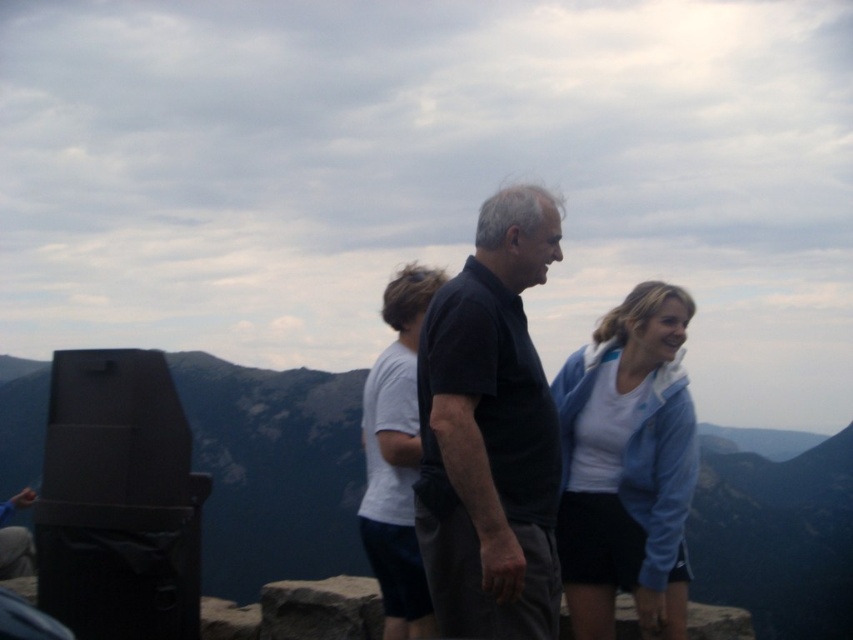
Question: From the image, what is the correct spatial relationship of black matte shirt at center in relation to light blue jacket at center?

Choices:
 (A) left
 (B) right

Answer: (A)

Question: Which object is the closest to the light blue jacket at center?

Choices:
 (A) black matte shirt at center
 (B) dark blue shirt at center
 (C) matte black grill at center-left

Answer: (B)

Question: Is dark blue shirt at center closer to the viewer compared to black matte shirt at center?

Choices:
 (A) no
 (B) yes

Answer: (B)

Question: Which point is closer to the camera?

Choices:
 (A) black matte shirt at center
 (B) matte black grill at center-left

Answer: (A)

Question: Among these points, which one is farthest from the camera?

Choices:
 (A) (595, 371)
 (B) (38, 368)
 (C) (529, 387)

Answer: (B)

Question: Can you confirm if black matte shirt at center is wider than light blue jacket at center?

Choices:
 (A) yes
 (B) no

Answer: (B)